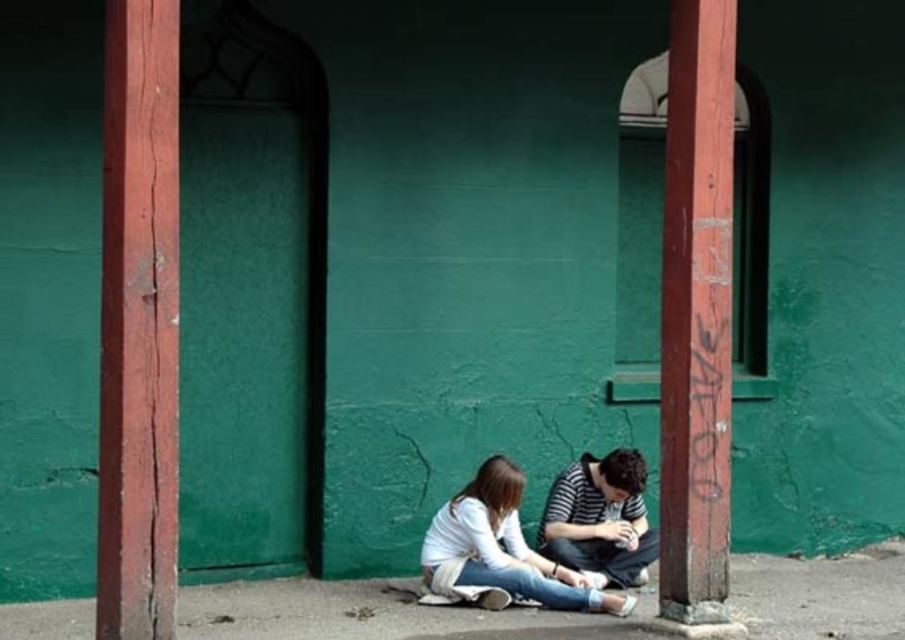
Question: Among these points, which one is farthest from the camera?

Choices:
 (A) (106, 113)
 (B) (353, 580)

Answer: (B)

Question: Which of the following is the farthest from the observer?

Choices:
 (A) smooth red wood at left
 (B) white cotton shirt at center
 (C) rusty wood post at right
 (D) striped cotton shirt at lower center

Answer: (D)

Question: Does smooth red wood at left have a smaller size compared to rusty wood post at right?

Choices:
 (A) yes
 (B) no

Answer: (A)

Question: Does smooth red wood at left appear under white cotton shirt at center?

Choices:
 (A) yes
 (B) no

Answer: (B)

Question: Considering the relative positions of rusty wood post at right and striped cotton shirt at lower center in the image provided, where is rusty wood post at right located with respect to striped cotton shirt at lower center?

Choices:
 (A) below
 (B) above

Answer: (B)

Question: Which point is farther to the camera?

Choices:
 (A) rusty wood post at right
 (B) striped cotton shirt at lower center
 (C) concrete pavement at lower center
 (D) white cotton shirt at center

Answer: (B)